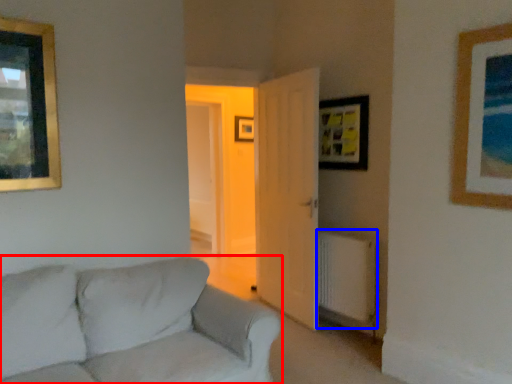
Question: Which object is closer to the camera taking this photo, studio couch (highlighted by a red box) or radiator (highlighted by a blue box)?

Choices:
 (A) studio couch
 (B) radiator

Answer: (A)